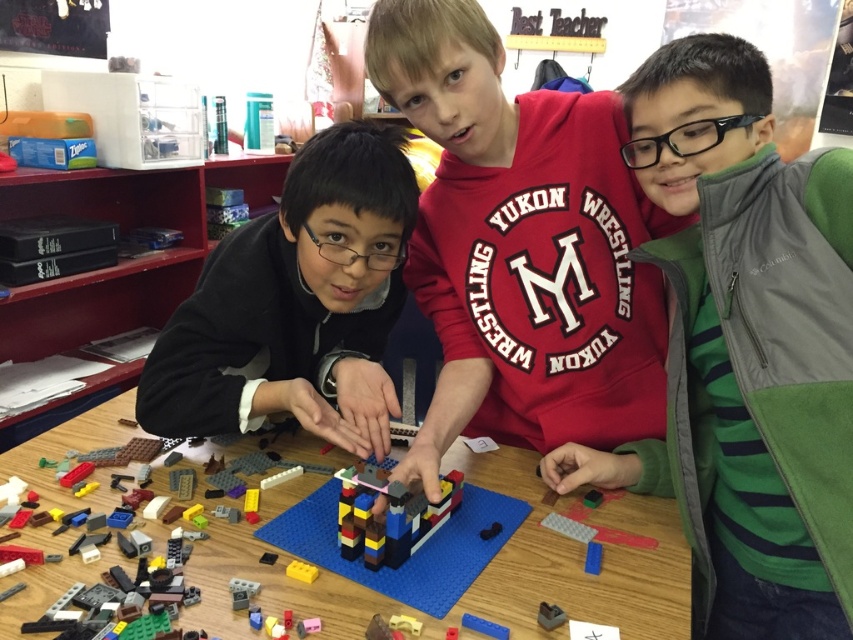
Does wooden table at center have a smaller size compared to brick-like plastic construction at center?

No, wooden table at center is not smaller than brick-like plastic construction at center.

Who is more distant from viewer, (672,515) or (363,506)?

Positioned behind is point (672,515).

Find the location of `wooden table at center`. wooden table at center is located at coordinates (479, 573).

Can you confirm if matte red sweatshirt at center is taller than blue plastic brick at center?

Yes.

Between point (527, 445) and point (505, 627), which one is positioned in front?

Point (505, 627)

Find the location of a particular element. Image resolution: width=853 pixels, height=640 pixels. matte red sweatshirt at center is located at coordinates (521, 246).

Is point (505, 637) farther from camera compared to point (287, 566)?

No, it is not.

Does blue plastic brick at center have a smaller size compared to yellow matte block at center?

Yes, blue plastic brick at center is smaller than yellow matte block at center.

This screenshot has height=640, width=853. I want to click on blue plastic brick at center, so click(485, 627).